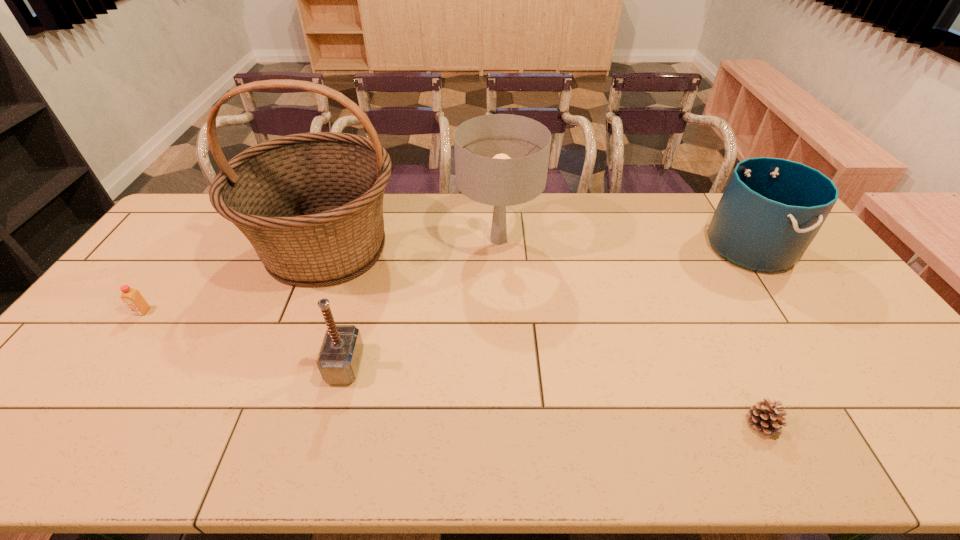
Where is `the tallest object`? The height and width of the screenshot is (540, 960). the tallest object is located at coordinates (311, 204).

This screenshot has width=960, height=540. In order to click on the third object from right to left in this screenshot , I will do `click(502, 160)`.

Where is `the second tallest object`? The height and width of the screenshot is (540, 960). the second tallest object is located at coordinates (502, 160).

This screenshot has height=540, width=960. What are the coordinates of `bucket` in the screenshot? It's located at (771, 210).

The image size is (960, 540). I want to click on the second nearest object, so click(x=338, y=361).

I want to click on the leftmost object, so click(132, 298).

At what (x,y) coordinates should I click in order to perform the action: click on the third nearest object. Please return your answer as a coordinate pair (x, y). The width and height of the screenshot is (960, 540). Looking at the image, I should click on (132, 298).

The width and height of the screenshot is (960, 540). In order to click on the shortest object in this screenshot , I will do `click(765, 416)`.

At what (x,y) coordinates should I click in order to perform the action: click on pinecone. Please return your answer as a coordinate pair (x, y). The height and width of the screenshot is (540, 960). Looking at the image, I should click on (765, 416).

Identify the location of blank space located on the front of the basket. This screenshot has height=540, width=960. (297, 327).